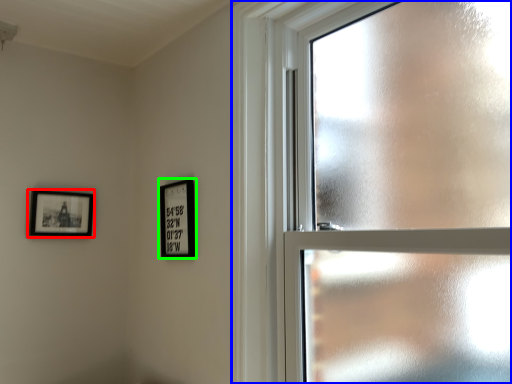
Question: Which object is positioned closest to picture frame (highlighted by a red box)? Select from window (highlighted by a blue box) and picture frame (highlighted by a green box).

Choices:
 (A) window
 (B) picture frame

Answer: (B)